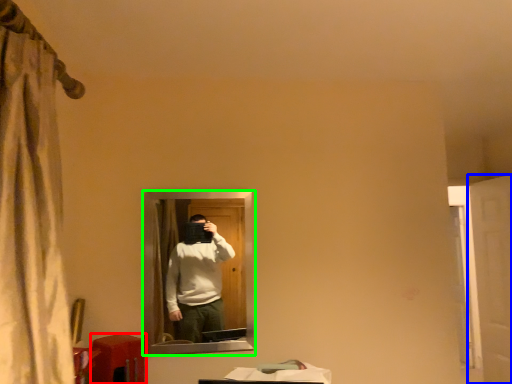
Question: Which object is the closest to the table (highlighted by a red box)? Choose among these: screen door (highlighted by a blue box) or mirror (highlighted by a green box).

Choices:
 (A) screen door
 (B) mirror

Answer: (B)